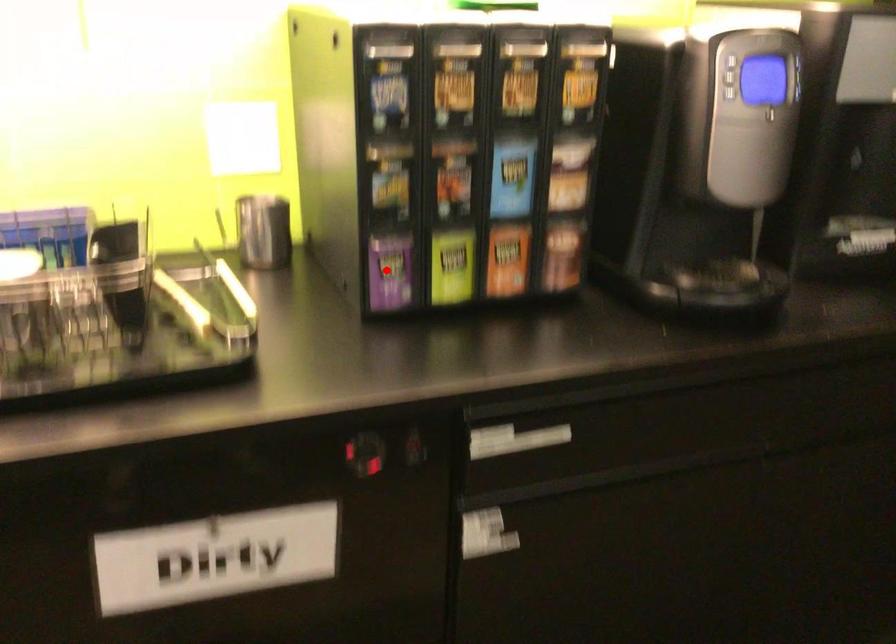
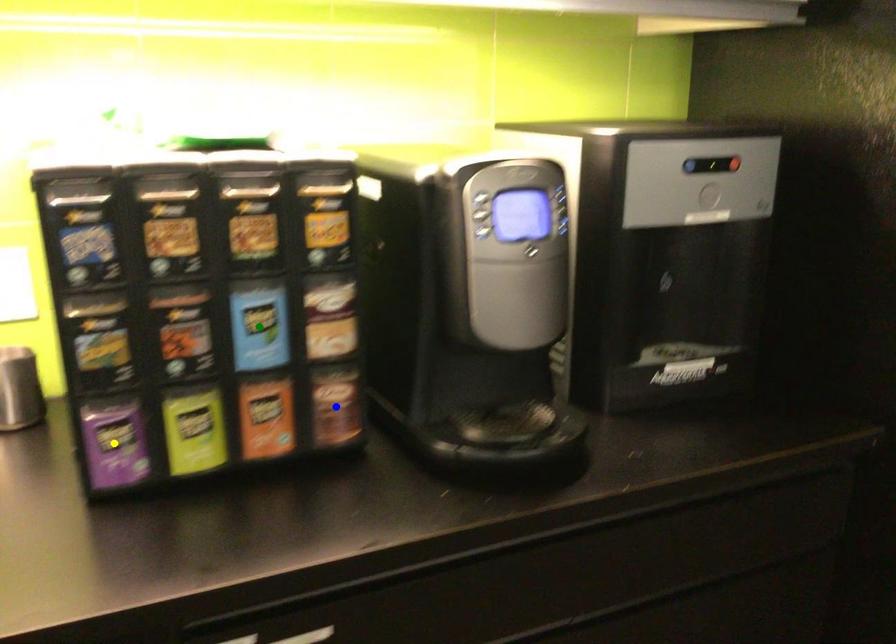
Question: I am providing you with two images of the same scene from different viewpoints. A red point is marked on the first image. You are given multiple points on the second image. Which point in image 2 represents the same 3d spot as the red point in image 1?

Choices:
 (A) green point
 (B) blue point
 (C) yellow point

Answer: (C)